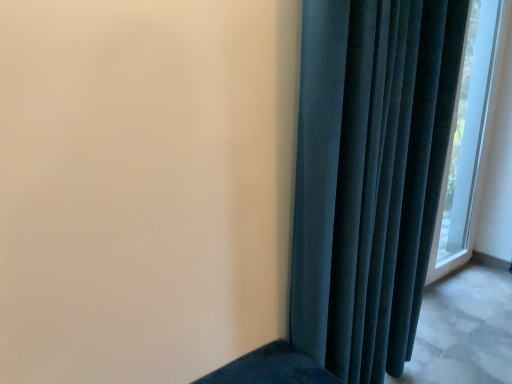
Question: From a real-world perspective, does velvet dark blue curtain at right sit lower than transparent glass window at right?

Choices:
 (A) yes
 (B) no

Answer: (A)

Question: Considering the relative sizes of velvet dark blue curtain at right and transparent glass window at right in the image provided, is velvet dark blue curtain at right wider than transparent glass window at right?

Choices:
 (A) no
 (B) yes

Answer: (B)

Question: Does velvet dark blue curtain at right have a larger size compared to transparent glass window at right?

Choices:
 (A) yes
 (B) no

Answer: (A)

Question: Does velvet dark blue curtain at right contain transparent glass window at right?

Choices:
 (A) no
 (B) yes

Answer: (A)

Question: Is velvet dark blue curtain at right to the right of transparent glass window at right from the viewer's perspective?

Choices:
 (A) no
 (B) yes

Answer: (A)

Question: Considering the relative sizes of velvet dark blue curtain at right and transparent glass window at right in the image provided, is velvet dark blue curtain at right taller than transparent glass window at right?

Choices:
 (A) yes
 (B) no

Answer: (B)

Question: From a real-world perspective, is transparent glass window at right positioned under velvet dark blue curtain at right based on gravity?

Choices:
 (A) yes
 (B) no

Answer: (B)

Question: Is transparent glass window at right facing towards velvet dark blue curtain at right?

Choices:
 (A) yes
 (B) no

Answer: (B)

Question: Is there a large distance between transparent glass window at right and velvet dark blue curtain at right?

Choices:
 (A) yes
 (B) no

Answer: (A)

Question: Is velvet dark blue curtain at right at the back of transparent glass window at right?

Choices:
 (A) no
 (B) yes

Answer: (A)

Question: Is transparent glass window at right bigger than velvet dark blue curtain at right?

Choices:
 (A) no
 (B) yes

Answer: (A)

Question: Is transparent glass window at right outside velvet dark blue curtain at right?

Choices:
 (A) no
 (B) yes

Answer: (B)

Question: From the image's perspective, is transparent glass window at right above or below velvet dark blue curtain at right?

Choices:
 (A) above
 (B) below

Answer: (A)